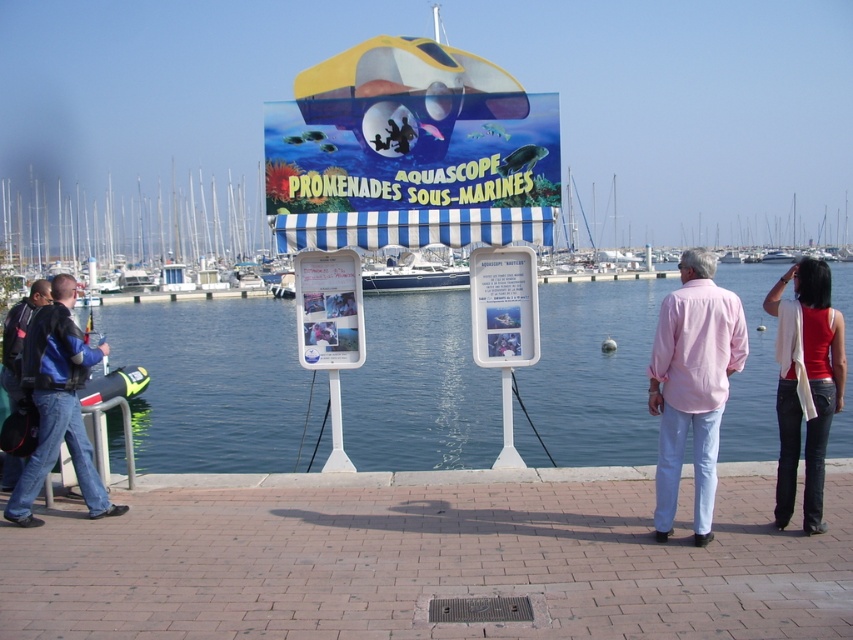
Is point (189, 401) positioned in front of point (721, 312)?

No, it is behind (721, 312).

In the scene shown: Can you confirm if clear blue water at center is smaller than pink cotton shirt at center?

Actually, clear blue water at center might be larger than pink cotton shirt at center.

Locate an element on the screen. The width and height of the screenshot is (853, 640). clear blue water at center is located at coordinates (212, 381).

This screenshot has width=853, height=640. In order to click on clear blue water at center in this screenshot , I will do `click(212, 381)`.

Which of these two, brick at lower center or white plastic boat at left, stands taller?

white plastic boat at left

Locate an element on the screen. brick at lower center is located at coordinates (430, 561).

Where is `brick at lower center`? The width and height of the screenshot is (853, 640). brick at lower center is located at coordinates (430, 561).

Is brick at lower center smaller than red cotton tank top at right?

Yes, brick at lower center is smaller than red cotton tank top at right.

Can you confirm if brick at lower center is thinner than red cotton tank top at right?

In fact, brick at lower center might be wider than red cotton tank top at right.

Is point (387, 611) farther from camera compared to point (815, 333)?

No, it is in front of (815, 333).

Image resolution: width=853 pixels, height=640 pixels. What are the coordinates of `brick at lower center` in the screenshot? It's located at (430, 561).